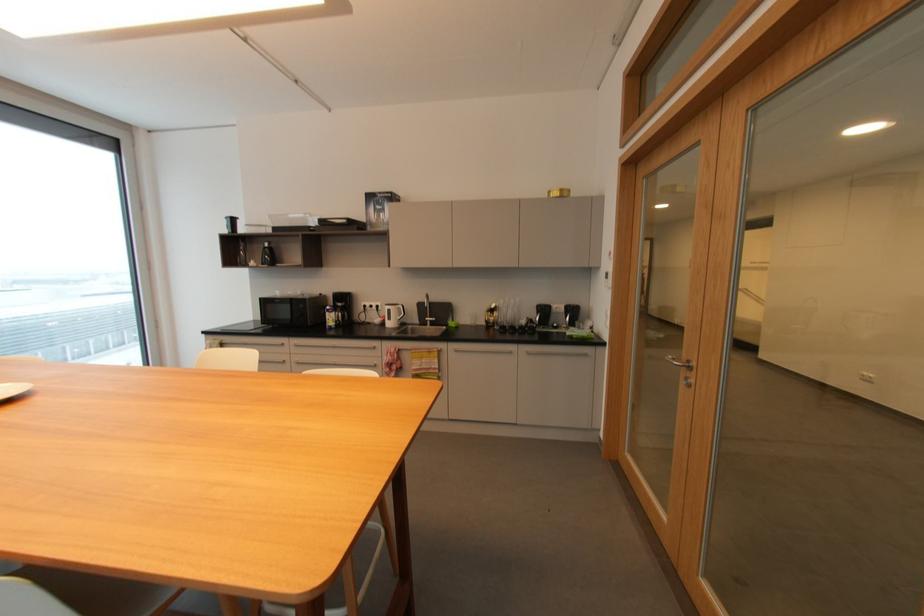
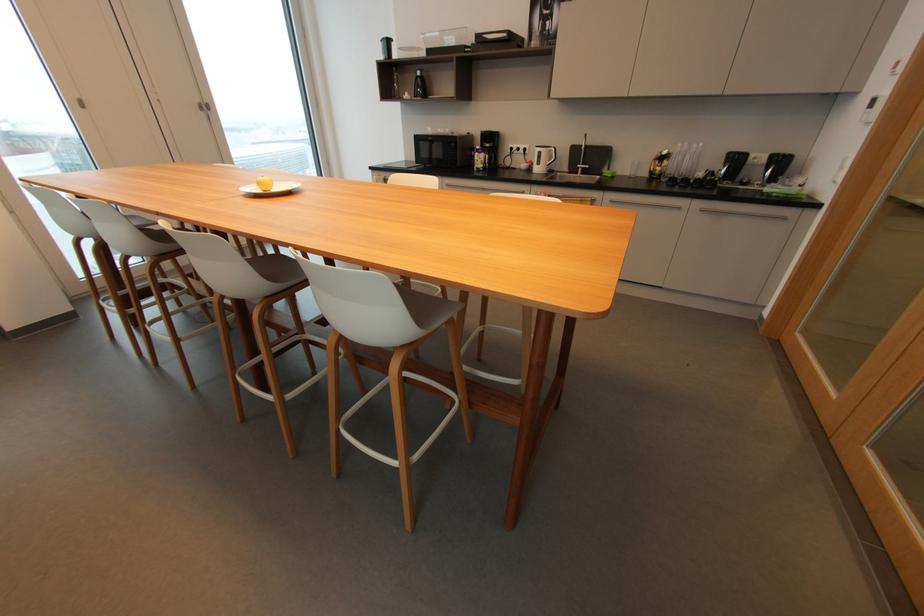
The point at (514, 353) is marked in the first image. Where is the corresponding point in the second image?

(683, 208)